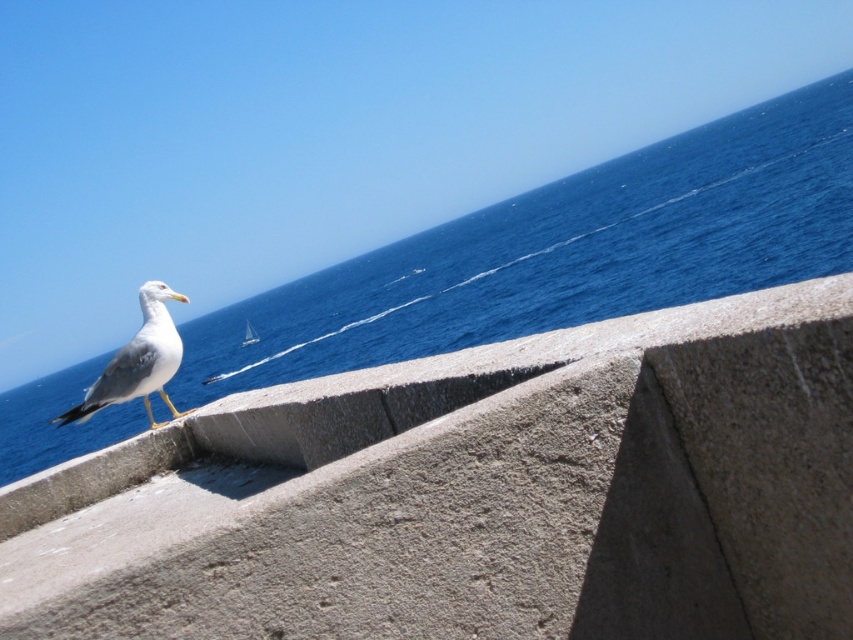
Is blue water at upper right thinner than white matte seagull at upper left?

No, blue water at upper right is not thinner than white matte seagull at upper left.

Is point (798, 182) positioned behind point (160, 296)?

Yes.

The height and width of the screenshot is (640, 853). Find the location of `blue water at upper right`. blue water at upper right is located at coordinates (564, 252).

Does concrete at left appear over white matte seagull at upper left?

Correct, concrete at left is located above white matte seagull at upper left.

The height and width of the screenshot is (640, 853). Describe the element at coordinates (477, 493) in the screenshot. I see `concrete at left` at that location.

Who is more distant from viewer, (234, 637) or (178, 337)?

Point (178, 337)

This screenshot has height=640, width=853. I want to click on concrete at left, so click(477, 493).

What are the coordinates of `concrete at left` in the screenshot? It's located at (477, 493).

Is point (785, 579) behind point (334, 321)?

No.

What are the coordinates of `concrete at left` in the screenshot? It's located at (477, 493).